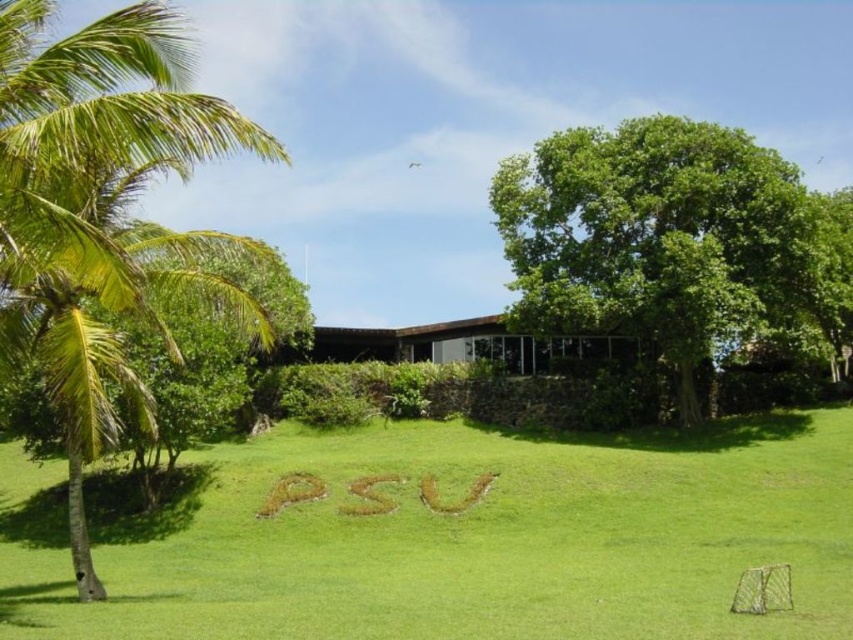
You are standing at the center of the grassy field in the park. You want to locate the green grass at center. What are the coordinates where you should look?

The green grass at center is located at coordinates point (474, 541).

You are planning to place a picnic blanket in the green grass at center and want to ensure there is enough space. Considering the green leafy palm tree at left, which object is wider?

The green grass at center is wider than the green leafy palm tree at left according to the description provided.